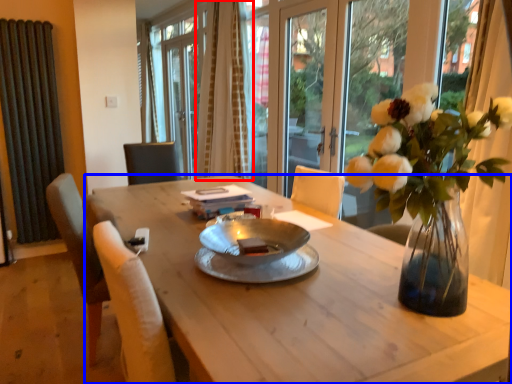
Question: Which object appears closest to the camera in this image, curtain (highlighted by a red box) or desk (highlighted by a blue box)?

Choices:
 (A) curtain
 (B) desk

Answer: (B)